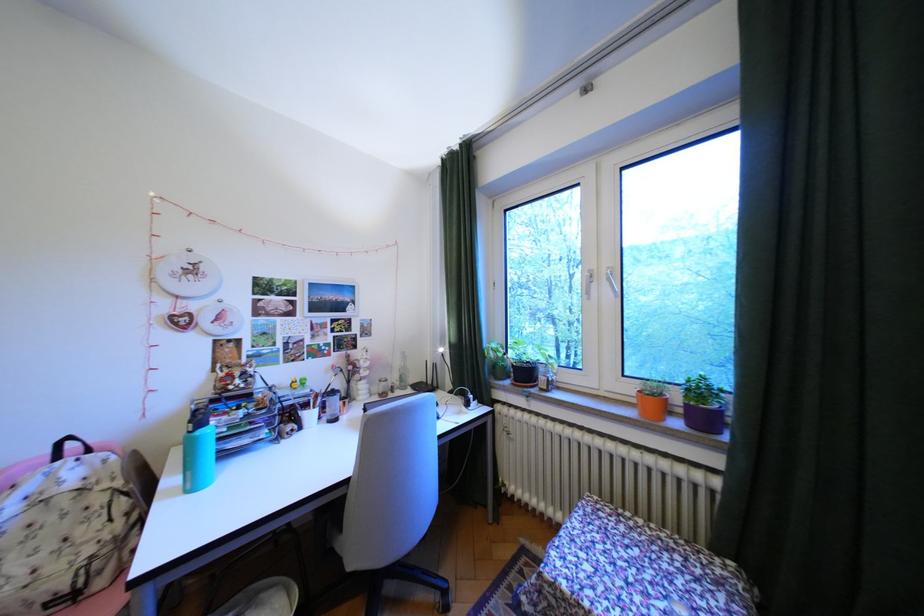
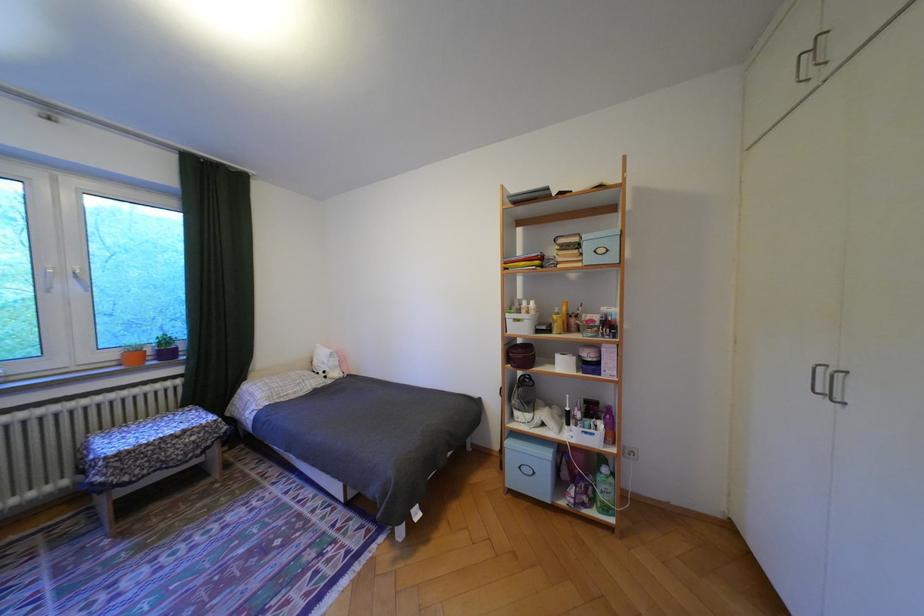
Find the pixel in the second image that matches pixel 641 390 in the first image.

(124, 355)